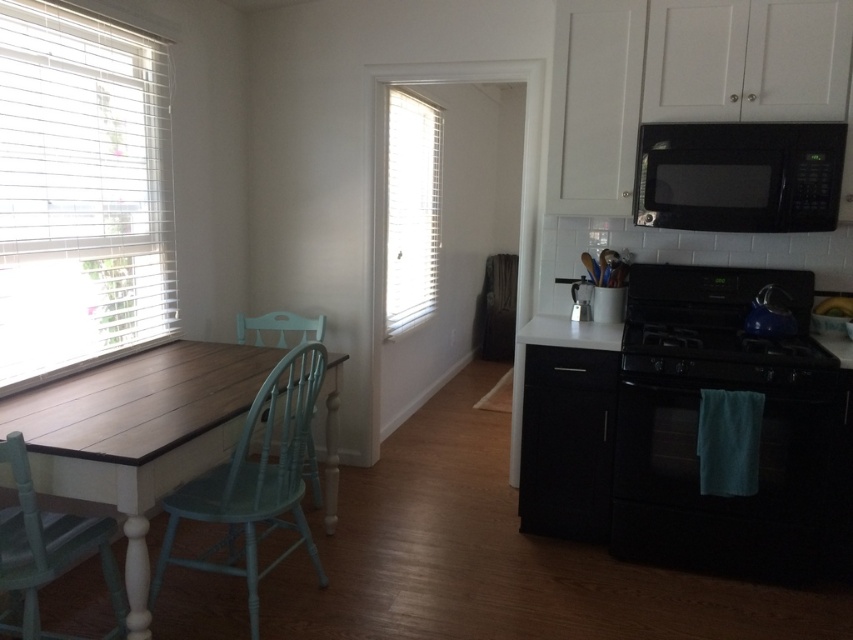
From the picture: Who is shorter, black matte oven at lower right or white wood blinds at center?

Standing shorter between the two is black matte oven at lower right.

Does black matte oven at lower right have a smaller size compared to white wood blinds at center?

Indeed, black matte oven at lower right has a smaller size compared to white wood blinds at center.

You are a GUI agent. You are given a task and a screenshot of the screen. Output one action in this format:
    pyautogui.click(x=<x>, y=<y>)
    Task: Click on the black matte oven at lower right
    The width and height of the screenshot is (853, 640).
    Given the screenshot: What is the action you would take?
    pyautogui.click(x=735, y=497)

Does black matte stove at lower right appear over light blue wood chair at center?

No.

Who is higher up, black matte stove at lower right or light blue wood chair at center?

light blue wood chair at center

The width and height of the screenshot is (853, 640). What do you see at coordinates (717, 348) in the screenshot? I see `black matte stove at lower right` at bounding box center [717, 348].

This screenshot has width=853, height=640. I want to click on black matte stove at lower right, so click(x=717, y=348).

Is white blinds at left taller than black matte stove at lower right?

Indeed, white blinds at left has a greater height compared to black matte stove at lower right.

Can you confirm if white blinds at left is positioned to the right of black matte stove at lower right?

Incorrect, white blinds at left is not on the right side of black matte stove at lower right.

Is point (45, 68) farther from camera compared to point (664, 323)?

That is False.

Image resolution: width=853 pixels, height=640 pixels. In order to click on white blinds at left in this screenshot , I will do `click(80, 192)`.